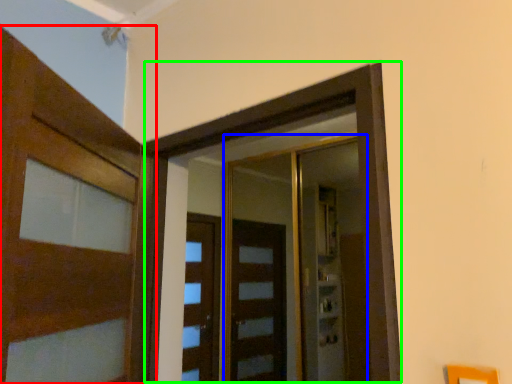
Question: Considering the real-world distances, which object is farthest from door (highlighted by a red box)? elevator (highlighted by a blue box) or elevator (highlighted by a green box)?

Choices:
 (A) elevator
 (B) elevator

Answer: (A)